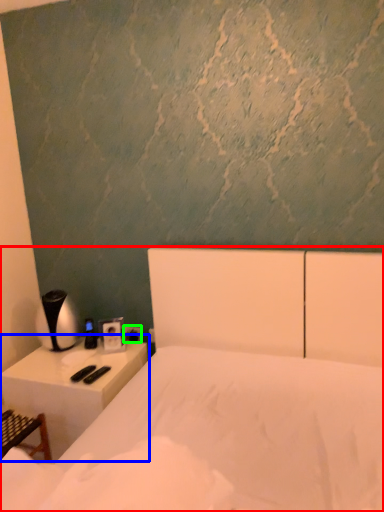
Question: Based on their relative distances, which object is nearer to bed (highlighted by a red box)? Choose from nightstand (highlighted by a blue box) and electric outlet (highlighted by a green box).

Choices:
 (A) nightstand
 (B) electric outlet

Answer: (A)